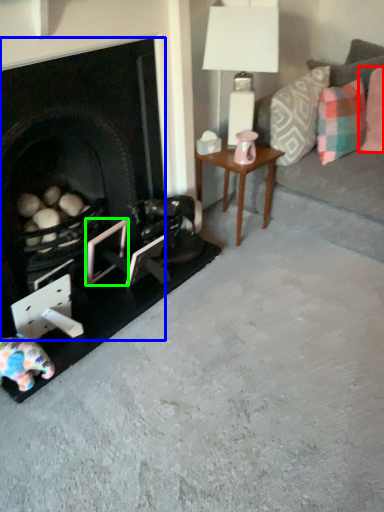
Question: Which object is the closest to the pillow (highlighted by a red box)? Choose among these: fireplace (highlighted by a blue box) or picture frame (highlighted by a green box).

Choices:
 (A) fireplace
 (B) picture frame

Answer: (A)